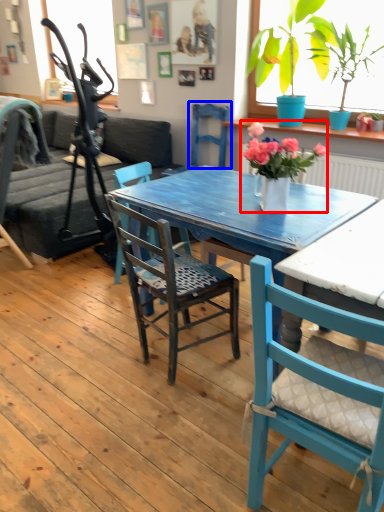
Question: Which of the following is the farthest to the observer, houseplant (highlighted by a red box) or armchair (highlighted by a blue box)?

Choices:
 (A) houseplant
 (B) armchair

Answer: (B)